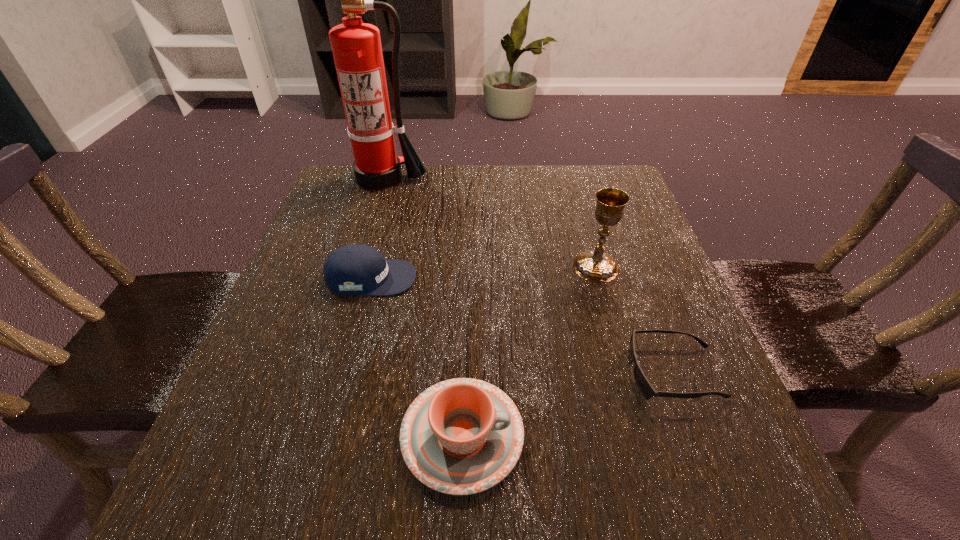
This screenshot has height=540, width=960. I want to click on blank region between the baseball cap and the sunglasses, so click(522, 326).

Identify the location of vacant space that's between the chinaware and the second tallest object. (529, 352).

The image size is (960, 540). Identify the location of vacant space that is in between the baseball cap and the chalice. (484, 272).

I want to click on blank region between the fire extinguisher and the baseball cap, so click(377, 228).

Find the location of a particular element. The width and height of the screenshot is (960, 540). free point between the third object from right to left and the tallest object is located at coordinates (422, 307).

Locate an element on the screen. The height and width of the screenshot is (540, 960). unoccupied position between the second tallest object and the chinaware is located at coordinates (529, 352).

The height and width of the screenshot is (540, 960). I want to click on object that stands as the second closest to the baseball cap, so click(356, 46).

Choose which object is the nearest neighbor to the shortest object. Please provide its 2D coordinates. Your answer should be formatted as a tuple, i.e. [(x, y)], where the tuple contains the x and y coordinates of a point satisfying the conditions above.

[(594, 265)]

Where is `free space that satisfies the following two spatial constraints: 1. on the front side of the chalice; 2. on the handle side of the chinaware`? This screenshot has height=540, width=960. free space that satisfies the following two spatial constraints: 1. on the front side of the chalice; 2. on the handle side of the chinaware is located at coordinates (645, 436).

You are a GUI agent. You are given a task and a screenshot of the screen. Output one action in this format:
    pyautogui.click(x=<x>, y=<y>)
    Task: Click on the free space that satisfies the following two spatial constraints: 1. at the nozzle of the chalice; 2. on the right side of the fire extinguisher
    Image resolution: width=960 pixels, height=540 pixels.
    Given the screenshot: What is the action you would take?
    pyautogui.click(x=355, y=267)